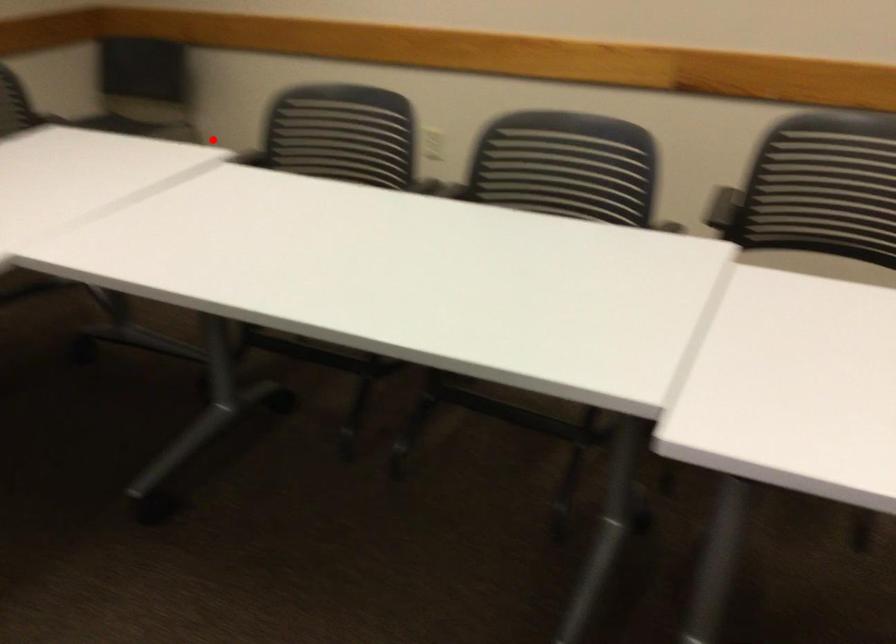
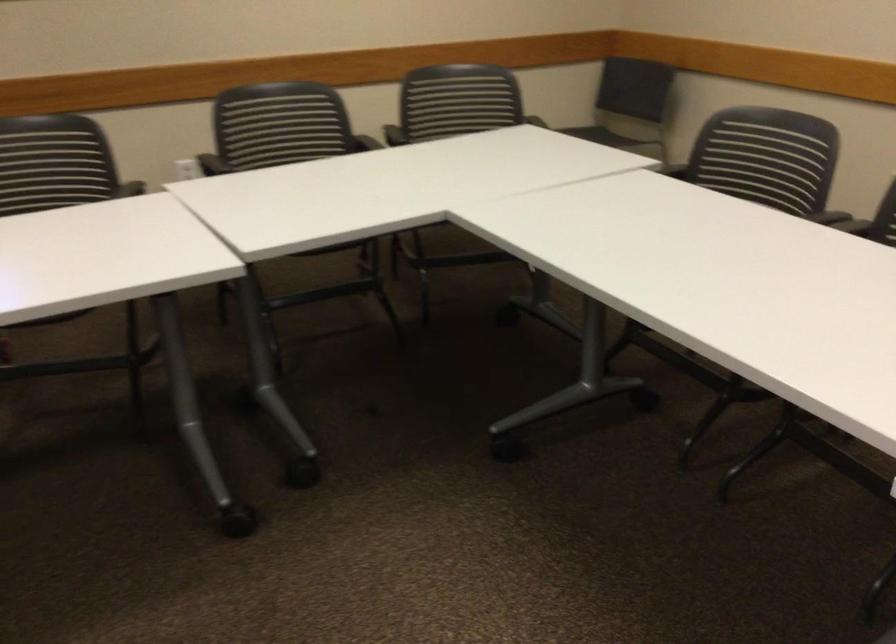
Locate, in the second image, the point that corresponds to the highlighted location in the first image.

(660, 158)